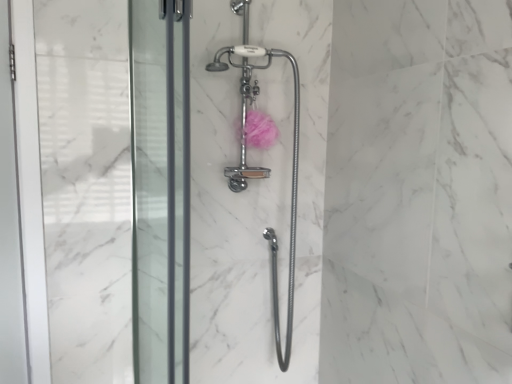
The height and width of the screenshot is (384, 512). Identify the location of transparent glass screen door at left. (160, 188).

The width and height of the screenshot is (512, 384). Describe the element at coordinates (160, 188) in the screenshot. I see `transparent glass screen door at left` at that location.

Identify the location of transparent glass screen door at left. The width and height of the screenshot is (512, 384). (160, 188).